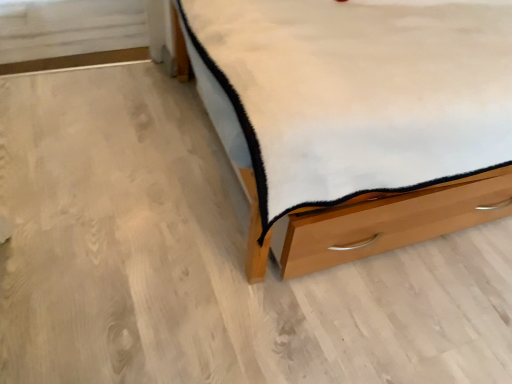
In order to face wooden chest of drawers at lower right, should I rotate leftwards or rightwards?

It's best to rotate right around 26.982 degrees.

This screenshot has height=384, width=512. I want to click on wooden chest of drawers at lower right, so click(361, 121).

Image resolution: width=512 pixels, height=384 pixels. What do you see at coordinates (361, 121) in the screenshot?
I see `wooden chest of drawers at lower right` at bounding box center [361, 121].

The width and height of the screenshot is (512, 384). Identify the location of wooden chest of drawers at lower right. (361, 121).